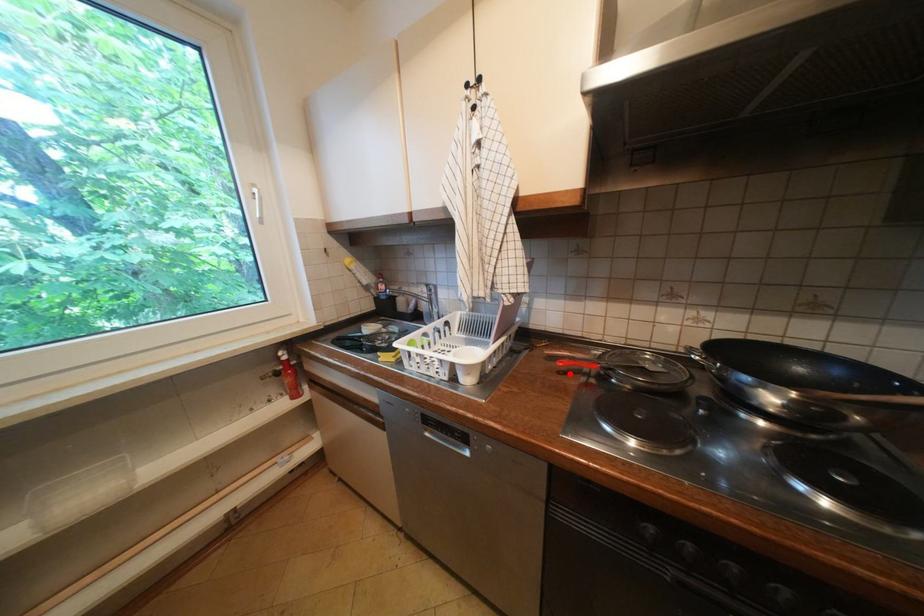
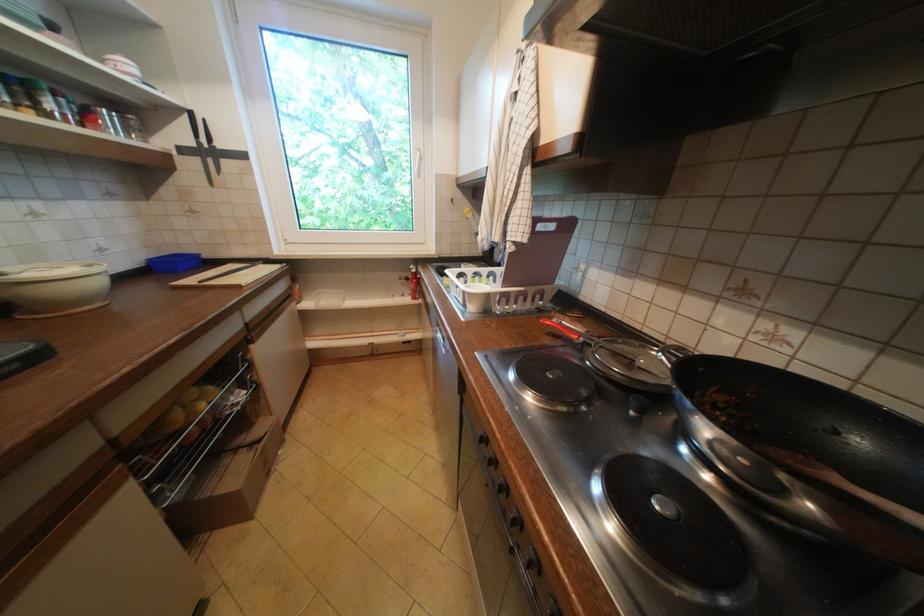
Find the pixel in the second image that matches the highlighted location in the first image.

(558, 334)